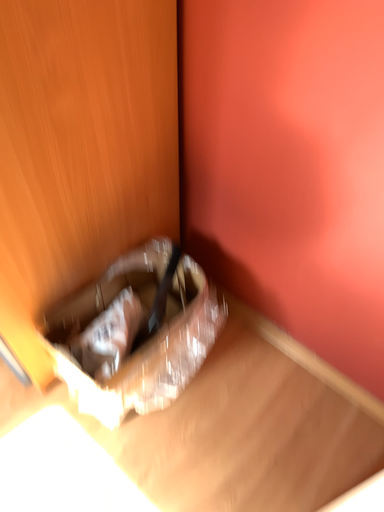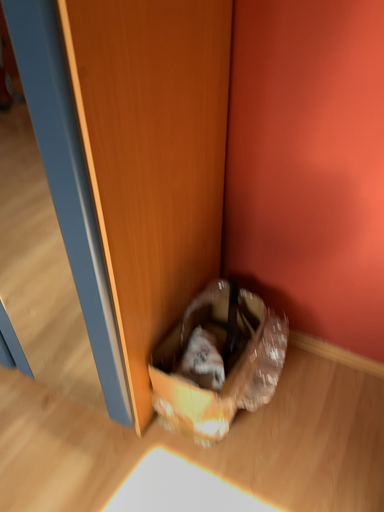
Question: Which way did the camera rotate in the video?

Choices:
 (A) rotated left
 (B) rotated right

Answer: (B)